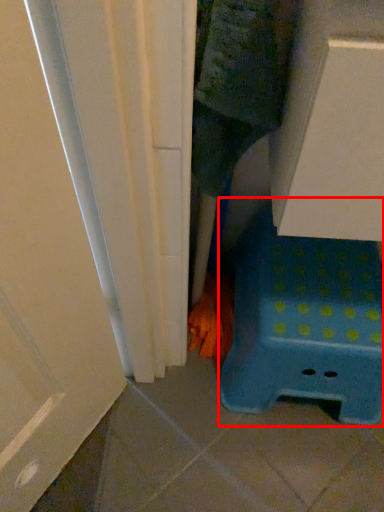
Question: Observing the image, what is the correct spatial positioning of furniture (annotated by the red box) in reference to hand?

Choices:
 (A) right
 (B) left

Answer: (A)